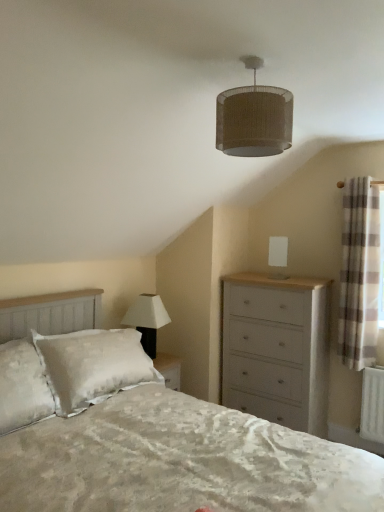
Question: Is white matte lamp at upper center, which is the 3th lamp from right to left, in front of or behind white matte lampshade at upper center, which appears as the 1th lamp when viewed from the back, in the image?

Choices:
 (A) behind
 (B) front

Answer: (B)

Question: Is white matte lamp at upper center, the 3th lamp in the top-to-bottom sequence, bigger or smaller than white matte lampshade at upper center, the 1th lamp when ordered from right to left?

Choices:
 (A) small
 (B) big

Answer: (B)

Question: Which object is the closest to the plaid fabric curtain at right?

Choices:
 (A) white textured bed at center
 (B) white matte lamp at upper center, the 3th lamp in the top-to-bottom sequence
 (C) burlap-textured lampshade at upper center, placed as the 2th lamp when sorted from left to right
 (D) plaid fabric curtain at right
 (E) white painted wood chest of drawers at right

Answer: (D)

Question: Which object is the closest to the white matte lampshade at upper center, the second lamp in the top-to-bottom sequence?

Choices:
 (A) plaid fabric curtain at right
 (B) white painted wood chest of drawers at right
 (C) burlap-textured lampshade at upper center, acting as the second lamp starting from the right
 (D) plaid fabric curtain at right
 (E) white matte lamp at upper center, marked as the 1th lamp in a left-to-right arrangement

Answer: (B)